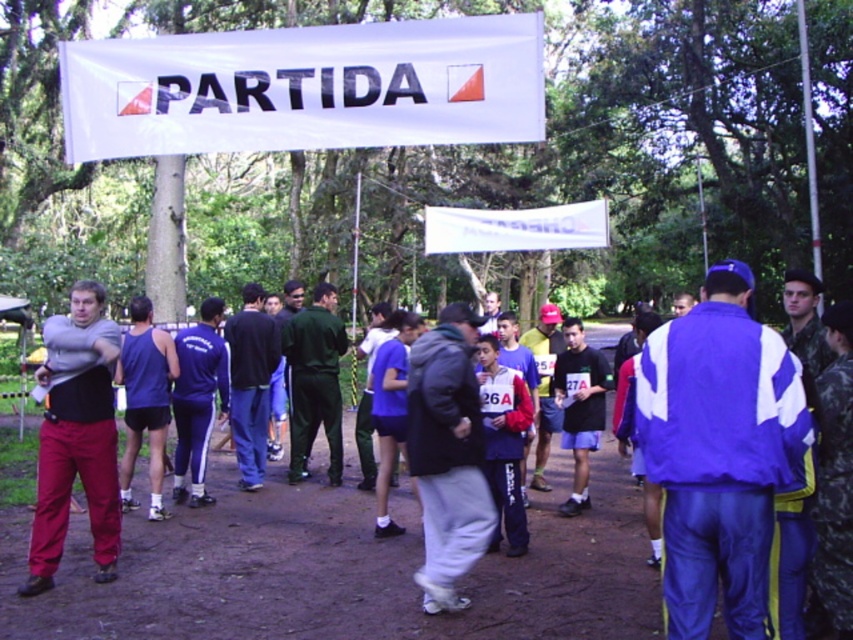
Question: Among these points, which one is farthest from the camera?

Choices:
 (A) (45, 516)
 (B) (248, 342)
 (C) (460, 458)

Answer: (B)

Question: Which is farther from the dark blue sweatpants at center?

Choices:
 (A) matte gray hoodie at center
 (B) white paper banner at upper center

Answer: (A)

Question: Does gray fleece jacket at center have a larger size compared to matte gray shirt at left?

Choices:
 (A) no
 (B) yes

Answer: (A)

Question: Can you confirm if dark blue sweatpants at center is positioned below matte gray hoodie at center?

Choices:
 (A) no
 (B) yes

Answer: (B)

Question: Is matte gray shirt at left bigger than matte gray hoodie at center?

Choices:
 (A) no
 (B) yes

Answer: (A)

Question: Which point is farther from the camera taking this photo?

Choices:
 (A) (392, 49)
 (B) (244, 424)
 (C) (97, 500)
 (D) (289, 346)

Answer: (D)